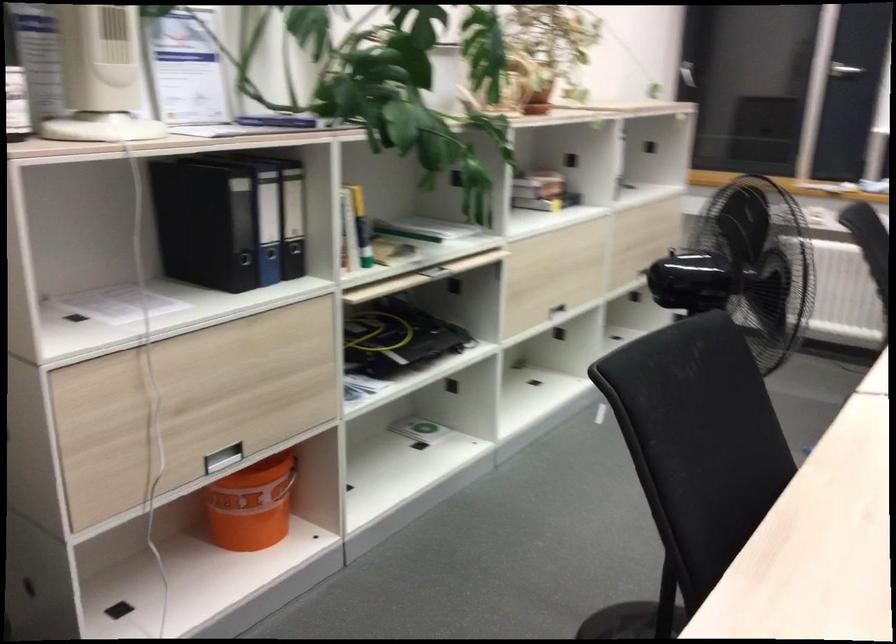
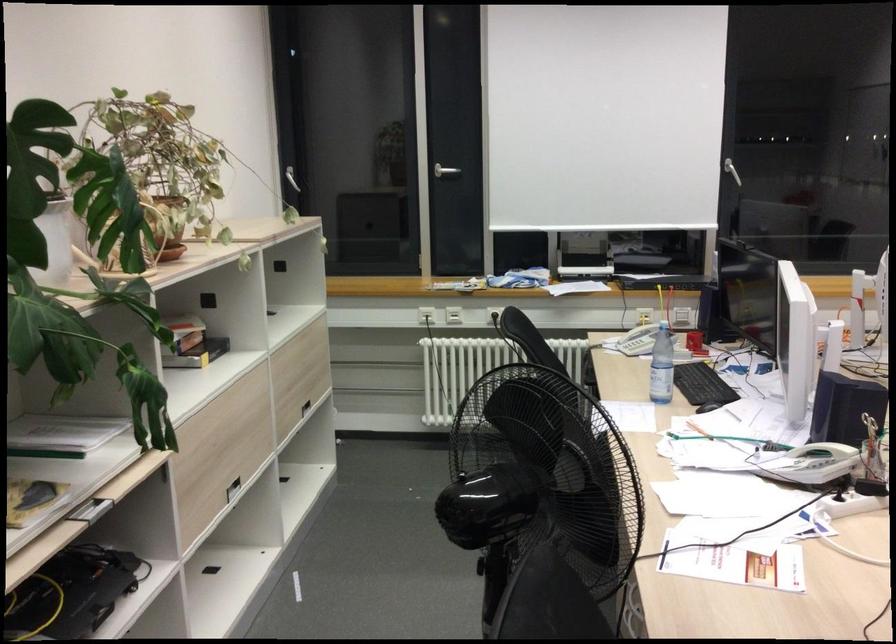
Find the pixel in the second image that matches (x=633, y=242) in the first image.

(298, 375)